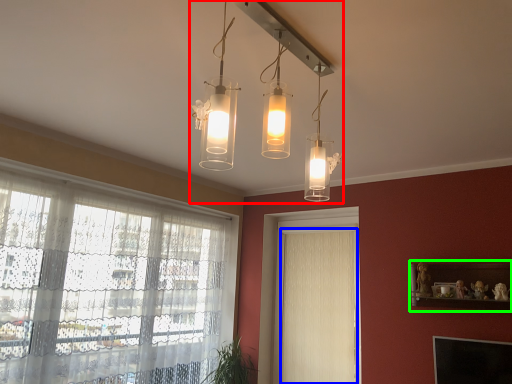
Question: Which object is the closest to the light fixture (highlighted by a red box)? Choose among these: curtain (highlighted by a blue box) or shelf (highlighted by a green box).

Choices:
 (A) curtain
 (B) shelf

Answer: (B)